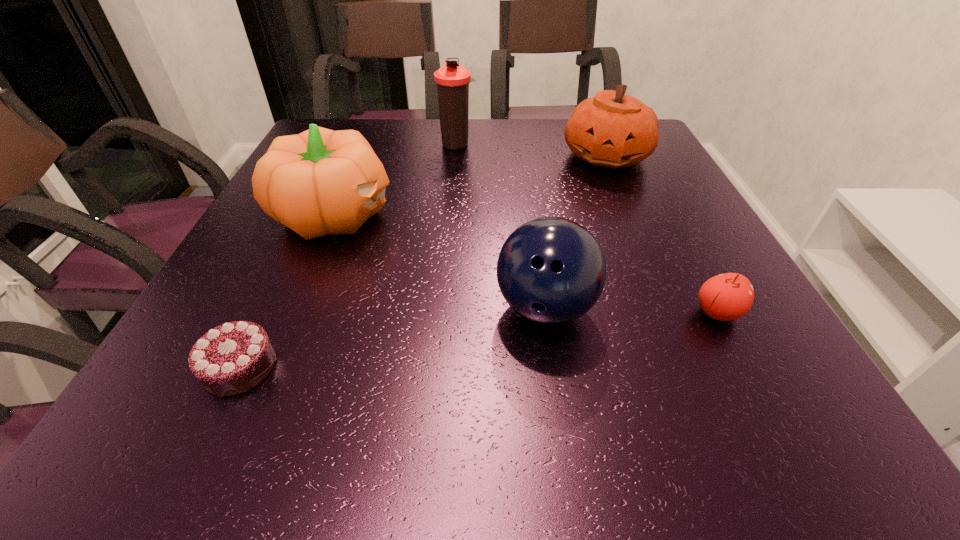
You are a GUI agent. You are given a task and a screenshot of the screen. Output one action in this format:
    pyautogui.click(x=<x>, y=<y>)
    Task: Click on the free space located 0.240m on the left of the second shortest object
    The width and height of the screenshot is (960, 540).
    Given the screenshot: What is the action you would take?
    pyautogui.click(x=554, y=312)

I want to click on free space located on the back of the chocolate cake, so click(282, 276).

In order to click on thermos bottle present at the far edge in this screenshot , I will do `click(452, 81)`.

This screenshot has width=960, height=540. In order to click on pumpkin situated at the far edge in this screenshot , I will do `click(612, 129)`.

Where is `object at the near edge`? object at the near edge is located at coordinates (232, 358).

Identify the location of pumpkin at the left edge. The width and height of the screenshot is (960, 540). (319, 182).

This screenshot has height=540, width=960. Find the location of `chocolate cake present at the left edge`. chocolate cake present at the left edge is located at coordinates (232, 358).

Image resolution: width=960 pixels, height=540 pixels. Find the location of `pumpkin that is at the right edge`. pumpkin that is at the right edge is located at coordinates (612, 129).

Where is `apple present at the right edge`? The image size is (960, 540). apple present at the right edge is located at coordinates (726, 297).

Where is `object that is at the near left corner`? object that is at the near left corner is located at coordinates (232, 358).